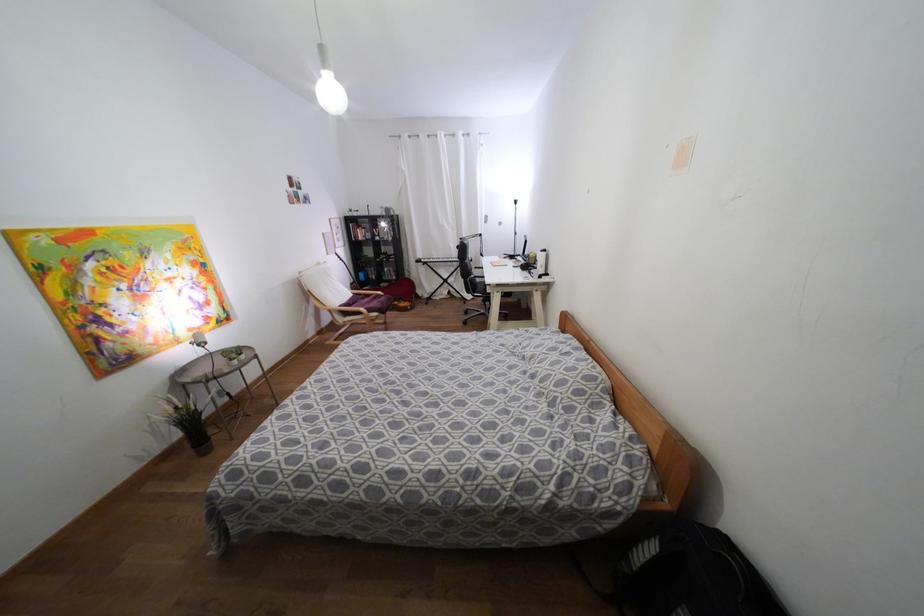
Locate an element on the screen. This screenshot has height=616, width=924. book on shelf is located at coordinates (360, 231).